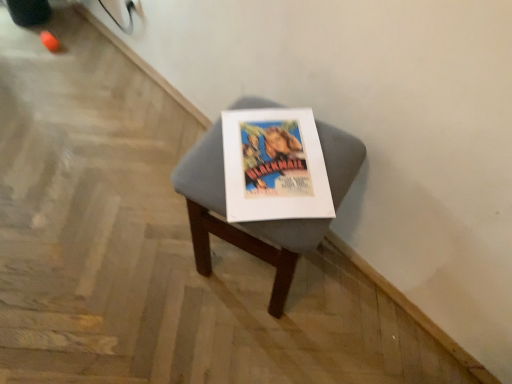
Where is `free space in front of gray fabric stool at center`? The width and height of the screenshot is (512, 384). free space in front of gray fabric stool at center is located at coordinates (243, 345).